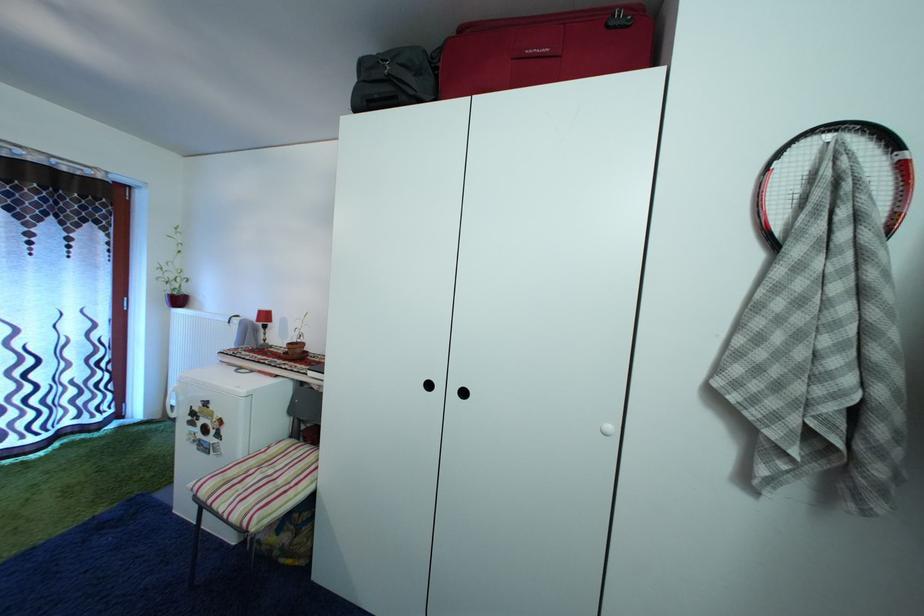
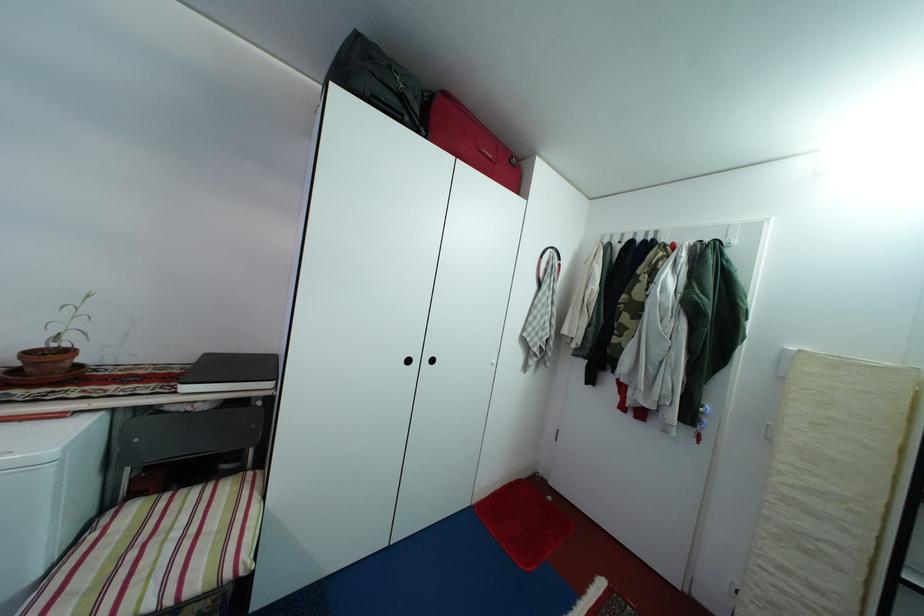
Locate, in the second image, the point that corresponds to the point at 298,351 in the first image.

(38, 361)